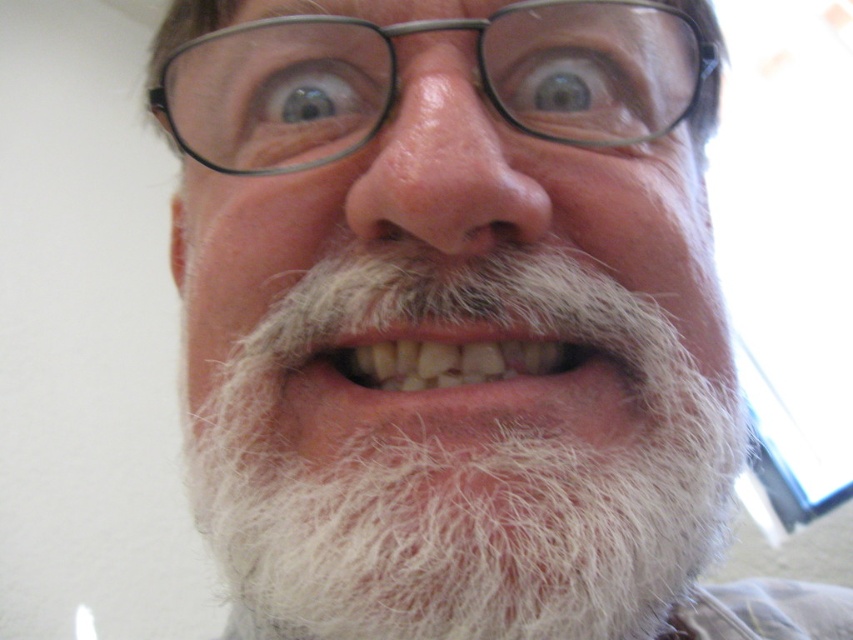
Question: Does white fuzzy beard at center lie in front of natural white teeth at center?

Choices:
 (A) no
 (B) yes

Answer: (B)

Question: Among these points, which one is nearest to the camera?

Choices:
 (A) (660, 468)
 (B) (380, 332)

Answer: (B)

Question: Which object is positioned closest to the white fuzzy beard at center?

Choices:
 (A) black plastic glasses at upper center
 (B) natural white teeth at center

Answer: (B)

Question: In this image, where is white fuzzy beard at center located relative to black plastic glasses at upper center?

Choices:
 (A) above
 (B) below

Answer: (B)

Question: Which is nearer to the white fuzzy beard at center?

Choices:
 (A) black plastic glasses at upper center
 (B) natural white teeth at center

Answer: (B)

Question: Is white fuzzy beard at center further to the viewer compared to natural white teeth at center?

Choices:
 (A) no
 (B) yes

Answer: (A)